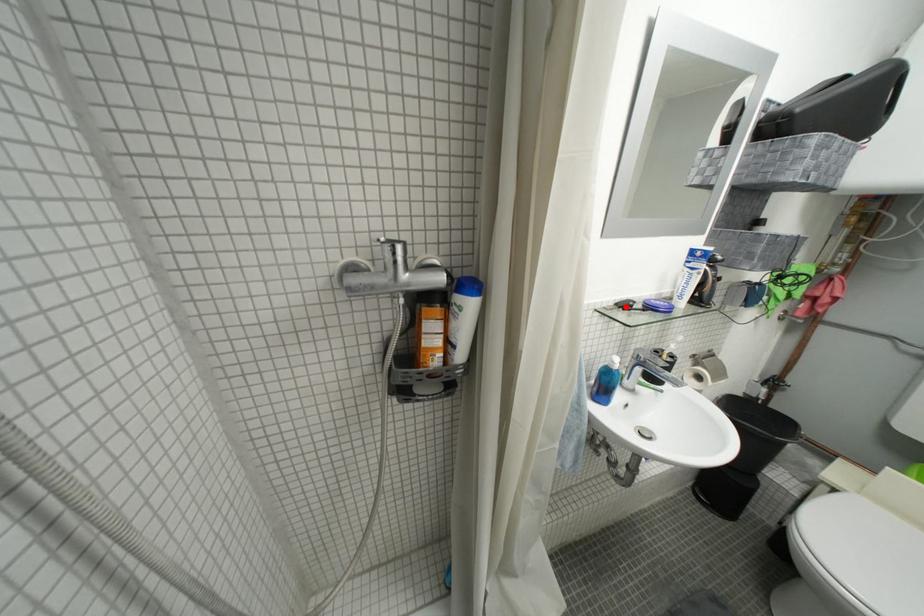
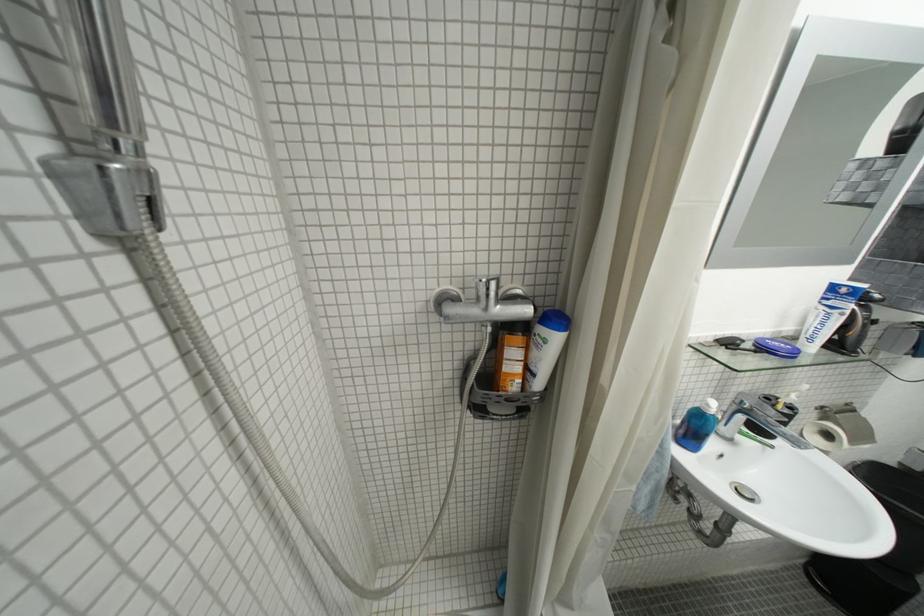
Locate, in the second image, the point that corresponds to the highlighted location in the first image.

(725, 342)